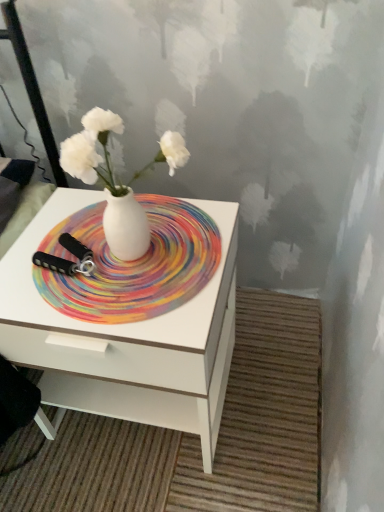
Question: Is point (69, 195) closer or farther from the camera than point (74, 168)?

Choices:
 (A) closer
 (B) farther

Answer: (B)

Question: Is white glossy nightstand at center to the left or to the right of white glossy vase at center in the image?

Choices:
 (A) left
 (B) right

Answer: (A)

Question: Considering the real-world distances, which object is farthest from the white glossy nightstand at center?

Choices:
 (A) rainbow swirl placemat at center
 (B) white glossy vase at center

Answer: (B)

Question: Which of these objects is positioned closest to the white glossy nightstand at center?

Choices:
 (A) rainbow swirl placemat at center
 (B) white glossy vase at center

Answer: (A)